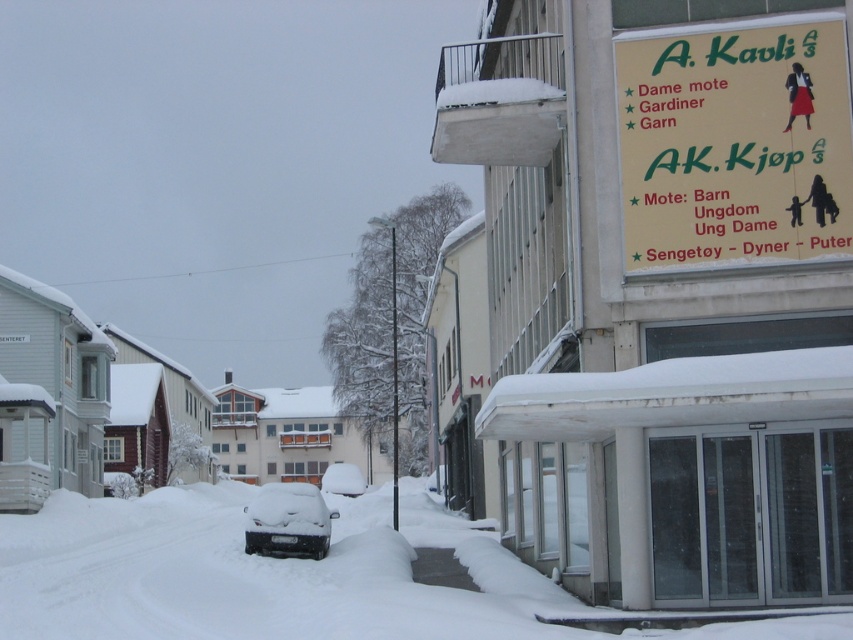
You are standing in the snowy urban street scene and want to take a photo of the point at coordinates point [778,125]. If your camera has a depth of field that can focus clearly up to 20 meters, will the point be in focus?

The distance of point [778,125] from the camera is 19.97 meters, which is within the camera focus range of up to 20 meters. Therefore, the point will be in focus.